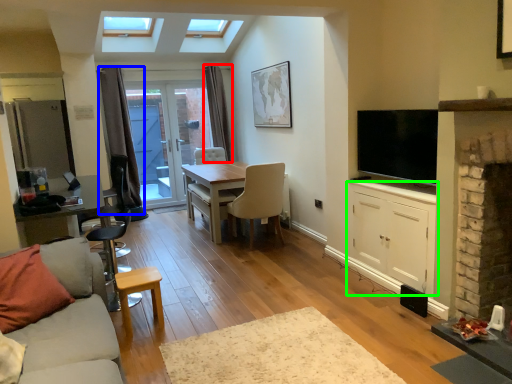
Question: Based on their relative distances, which object is farther from curtain (highlighted by a red box)? Choose from curtain (highlighted by a blue box) and cabinetry (highlighted by a green box).

Choices:
 (A) curtain
 (B) cabinetry

Answer: (B)